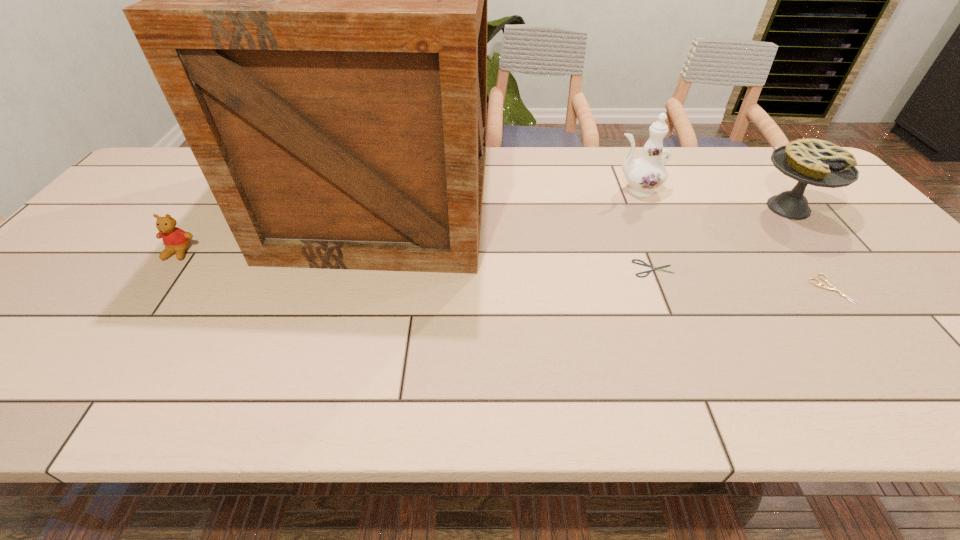
Identify the location of the fifth object from right to left. pyautogui.click(x=314, y=0).

What are the coordinates of `the tallest object` in the screenshot? It's located at (314, 0).

Identify the location of the fifth shortest object. (645, 174).

Identify the location of pie. (820, 163).

Where is `the third shortest object`? This screenshot has height=540, width=960. the third shortest object is located at coordinates (176, 240).

Find the location of a particular element. the leftmost object is located at coordinates (176, 240).

The height and width of the screenshot is (540, 960). What are the coordinates of `the taller shears` in the screenshot? It's located at (824, 286).

At what (x,y) coordinates should I click in order to perform the action: click on the right shears. Please return your answer as a coordinate pair (x, y). The height and width of the screenshot is (540, 960). Looking at the image, I should click on (824, 286).

The image size is (960, 540). Find the location of `the shorter shears`. the shorter shears is located at coordinates coord(645,264).

Where is `the shortest object`? the shortest object is located at coordinates (645, 264).